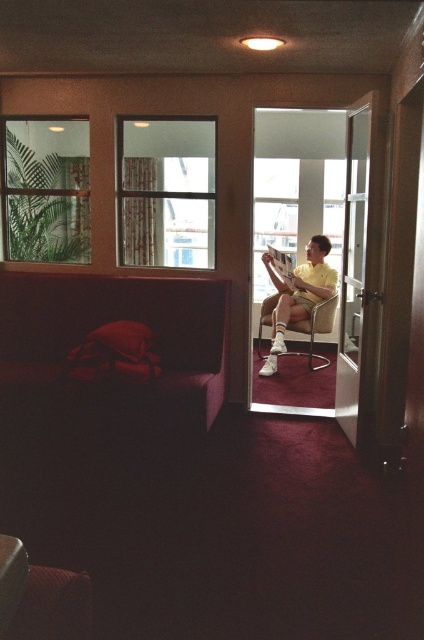
Does clear glass window at upper center appear under hardcover book at center?

Actually, clear glass window at upper center is above hardcover book at center.

Which of these two, clear glass window at upper center or hardcover book at center, stands shorter?

hardcover book at center

Does point (200, 156) come farther from viewer compared to point (282, 268)?

No, (200, 156) is in front of (282, 268).

The height and width of the screenshot is (640, 424). What are the coordinates of `clear glass window at upper center` in the screenshot? It's located at (166, 192).

Is wooden textured rocking chair at lower left to the right of hardcover book at center from the viewer's perspective?

Incorrect, wooden textured rocking chair at lower left is not on the right side of hardcover book at center.

Who is higher up, wooden textured rocking chair at lower left or hardcover book at center?

Positioned higher is hardcover book at center.

Where is `wooden textured rocking chair at lower left`? The image size is (424, 640). wooden textured rocking chair at lower left is located at coordinates (41, 596).

Identify the location of wooden textured rocking chair at lower left. This screenshot has width=424, height=640. (41, 596).

Looking at this image, is green leafy plant at left below wooden textured rocking chair at lower left?

Incorrect, green leafy plant at left is not positioned below wooden textured rocking chair at lower left.

Between point (72, 193) and point (53, 605), which one is positioned in front?

Point (53, 605) is more forward.

The image size is (424, 640). What do you see at coordinates (44, 188) in the screenshot?
I see `green leafy plant at left` at bounding box center [44, 188].

At what (x,y) coordinates should I click in order to perform the action: click on green leafy plant at left. Please return your answer as a coordinate pair (x, y). This screenshot has width=424, height=640. Looking at the image, I should click on (44, 188).